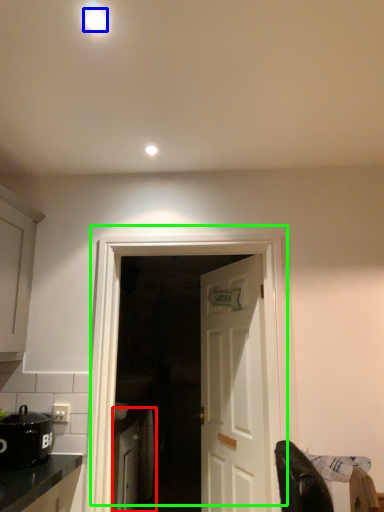
Question: Which object is positioned closest to cabinetry (highlighted by a red box)? Select from lighting (highlighted by a blue box) and door (highlighted by a green box).

Choices:
 (A) lighting
 (B) door

Answer: (B)